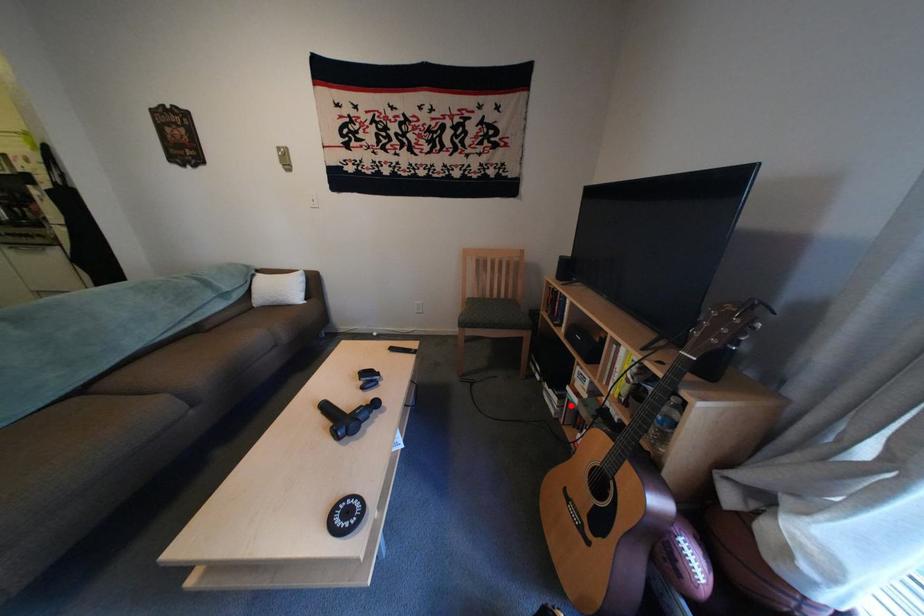
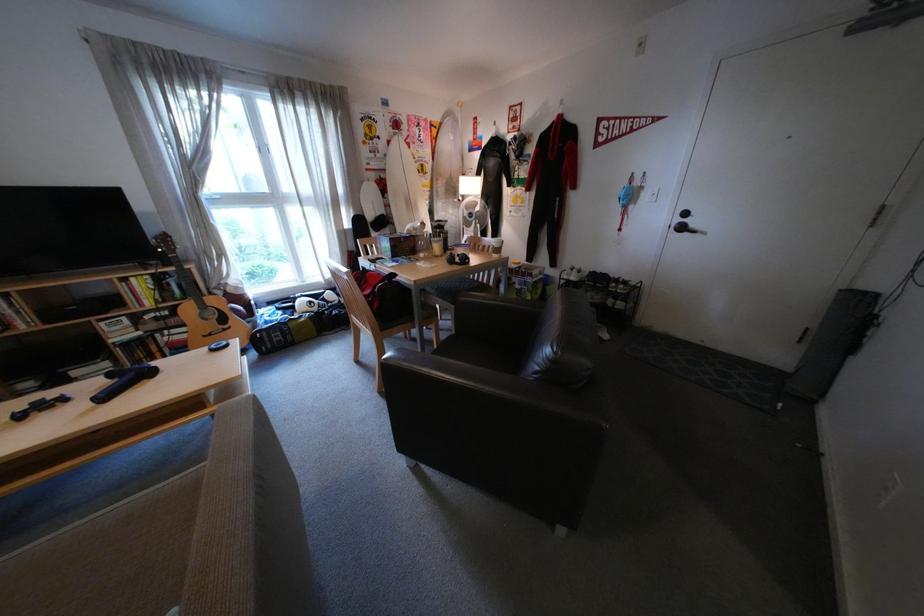
Where in the second image is the point corresponding to the highlighted location from the first image?

(126, 367)